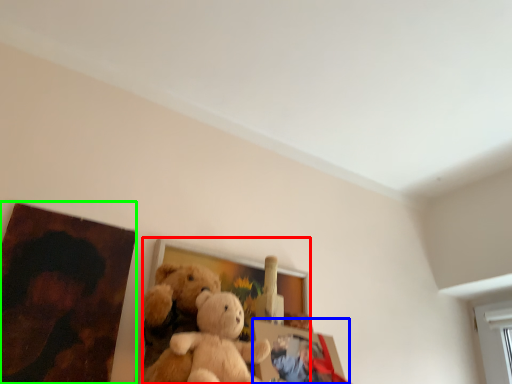
Question: Estimate the real-world distances between objects in this image. Which object is farther from picture frame (highlighted by a red box), picture frame (highlighted by a blue box) or picture frame (highlighted by a green box)?

Choices:
 (A) picture frame
 (B) picture frame

Answer: (B)